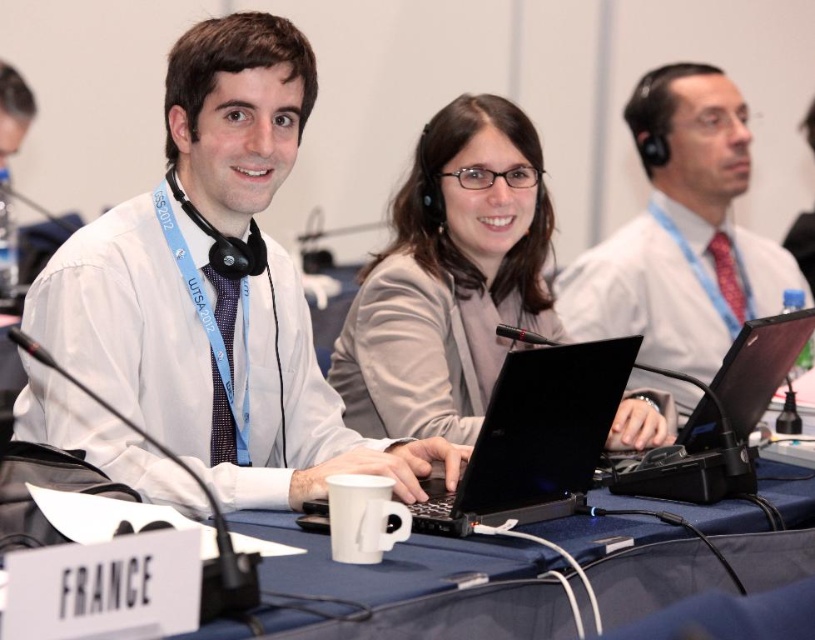
You are organizing a conference and need to ensure that all nameplates are visible to the camera. The white shirt at center and the black plastic laptop at center are both on the table. Which object is taller and might block the nameplate if placed too close?

The white shirt at center has a greater height compared to the black plastic laptop at center, so it might block the nameplate if placed too close.

You are an attendee at this conference. You see the white shirt at center and the black plastic laptop at center. Which object is closer to you?

The white shirt at center is closer to you because it is in front of the black plastic laptop at center.

You are sitting at the conference table and notice two points marked on the table. The first point is at coordinate (276,456) and the second point is at coordinate (467,406). From your perspective, which point is closer to you?

Point (276,456) is in front of point (467,406), so it is closer to you.